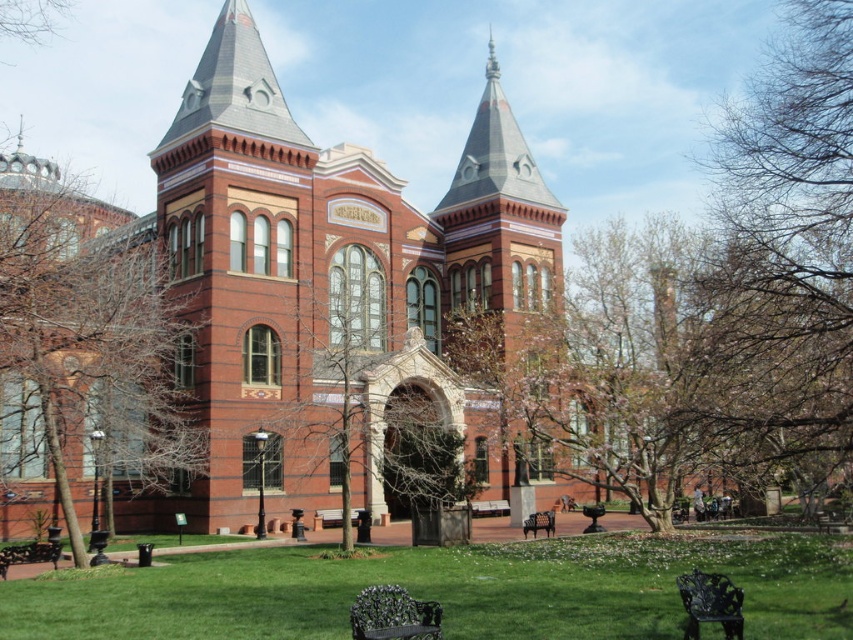
From the picture: Who is shorter, bare branches at center or wooden park bench at lower left?

wooden park bench at lower left is shorter.

Which is more to the left, bare branches at center or wooden park bench at lower left?

wooden park bench at lower left is more to the left.

Between point (834, 56) and point (26, 557), which one is positioned in front?

Point (834, 56) is more forward.

The image size is (853, 640). I want to click on bare branches at center, so coord(712,301).

Does bare wood tree at center have a greater height compared to wooden park bench at center?

Indeed, bare wood tree at center has a greater height compared to wooden park bench at center.

Which is behind, point (323, 326) or point (335, 513)?

The point (323, 326) is behind.

Which is in front, point (426, 419) or point (352, 516)?

Point (352, 516) is more forward.

Identify the location of bare wood tree at center. (375, 394).

Who is more forward, (827, 51) or (691, 609)?

Positioned in front is point (691, 609).

Where is `bare branches at center`? This screenshot has width=853, height=640. bare branches at center is located at coordinates (712, 301).

Is point (828, 173) positioned before point (708, 588)?

No, it is behind (708, 588).

Identify the location of bare branches at center. (712, 301).